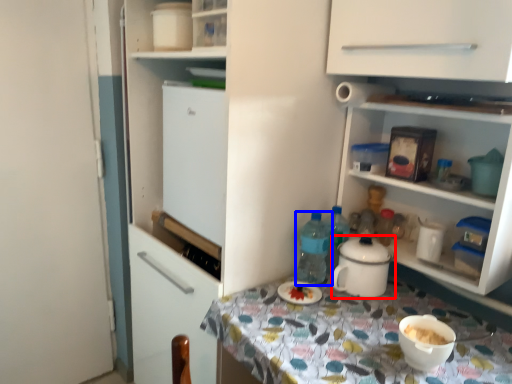
Question: Which point is further to the camera, kitchen appliance (highlighted by a red box) or bottle (highlighted by a blue box)?

Choices:
 (A) kitchen appliance
 (B) bottle

Answer: (B)